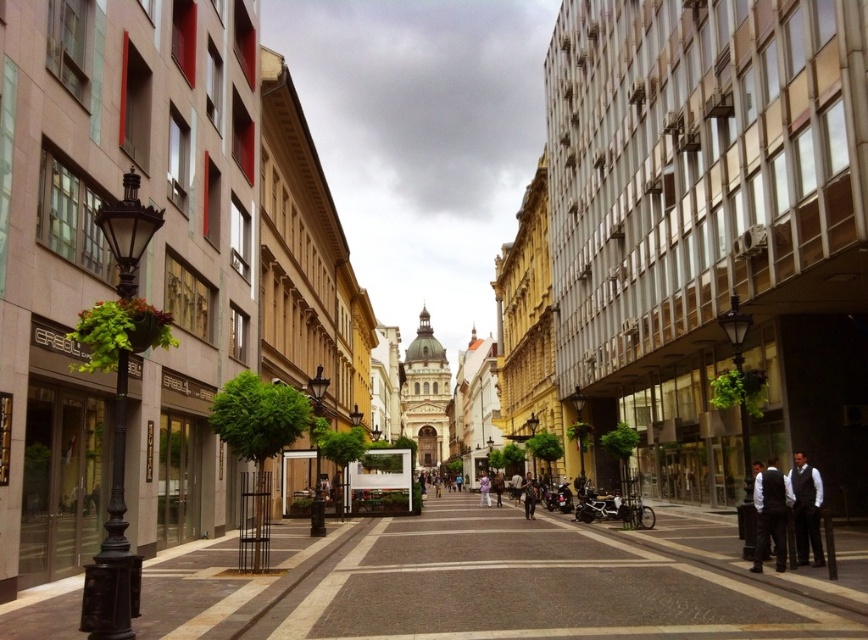
Who is positioned more to the left, dark gray suit at lower right or dark gray suit at right?

dark gray suit at lower right

Does point (774, 536) come behind point (809, 492)?

That is False.

What do you see at coordinates (770, 513) in the screenshot? I see `dark gray suit at lower right` at bounding box center [770, 513].

The width and height of the screenshot is (868, 640). What are the coordinates of `dark gray suit at lower right` in the screenshot? It's located at (770, 513).

Measure the distance from dark gray suit at right to white fabric person at center.

A distance of 58.09 meters exists between dark gray suit at right and white fabric person at center.

Is dark gray suit at right taller than white fabric person at center?

In fact, dark gray suit at right may be shorter than white fabric person at center.

Describe the element at coordinates (806, 509) in the screenshot. This screenshot has height=640, width=868. I see `dark gray suit at right` at that location.

Locate an element on the screen. dark gray suit at right is located at coordinates (806, 509).

Which is above, dark gray suit at lower right or white fabric person at center?

Positioned higher is dark gray suit at lower right.

Between dark gray suit at lower right and white fabric person at center, which one appears on the left side from the viewer's perspective?

Positioned to the left is white fabric person at center.

What are the coordinates of `dark gray suit at lower right` in the screenshot? It's located at (770, 513).

You are a GUI agent. You are given a task and a screenshot of the screen. Output one action in this format:
    pyautogui.click(x=<x>, y=<y>)
    Task: Click on the dark gray suit at lower right
    
    Given the screenshot: What is the action you would take?
    pyautogui.click(x=770, y=513)